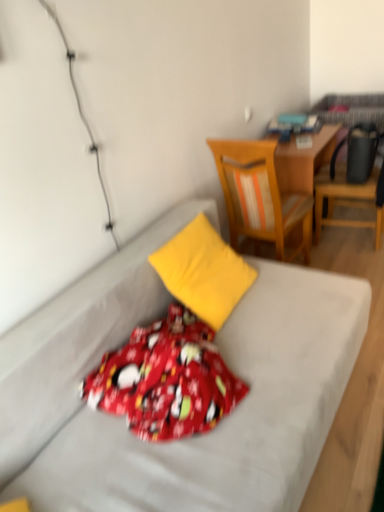
Question: From the image's perspective, does yellow fabric pillow at center appear lower than red cotton blanket at center?

Choices:
 (A) yes
 (B) no

Answer: (B)

Question: Considering the relative sizes of yellow fabric pillow at center and red cotton blanket at center in the image provided, is yellow fabric pillow at center wider than red cotton blanket at center?

Choices:
 (A) no
 (B) yes

Answer: (A)

Question: Is yellow fabric pillow at center in front of red cotton blanket at center?

Choices:
 (A) yes
 (B) no

Answer: (B)

Question: Can you confirm if yellow fabric pillow at center is smaller than red cotton blanket at center?

Choices:
 (A) no
 (B) yes

Answer: (A)

Question: From a real-world perspective, is yellow fabric pillow at center positioned under red cotton blanket at center based on gravity?

Choices:
 (A) no
 (B) yes

Answer: (A)

Question: Does yellow fabric pillow at center have a greater height compared to red cotton blanket at center?

Choices:
 (A) no
 (B) yes

Answer: (B)

Question: From the image's perspective, is yellow fabric pillow at center located beneath wooden chair at upper right, which is the 1th chair in left-to-right order?

Choices:
 (A) yes
 (B) no

Answer: (A)

Question: Is yellow fabric pillow at center looking in the opposite direction of wooden chair at upper right, the second chair from the right?

Choices:
 (A) no
 (B) yes

Answer: (A)

Question: Does yellow fabric pillow at center appear on the left side of wooden chair at upper right, which is the 1th chair in left-to-right order?

Choices:
 (A) no
 (B) yes

Answer: (B)

Question: Is yellow fabric pillow at center with wooden chair at upper right, the second chair from the right?

Choices:
 (A) no
 (B) yes

Answer: (A)

Question: Is yellow fabric pillow at center wider than wooden chair at upper right, which is the 1th chair in left-to-right order?

Choices:
 (A) no
 (B) yes

Answer: (A)

Question: Is yellow fabric pillow at center further to camera compared to wooden chair at upper right, which is the 1th chair in left-to-right order?

Choices:
 (A) yes
 (B) no

Answer: (B)

Question: Is wooden desk at center oriented away from red cotton blanket at center?

Choices:
 (A) yes
 (B) no

Answer: (B)